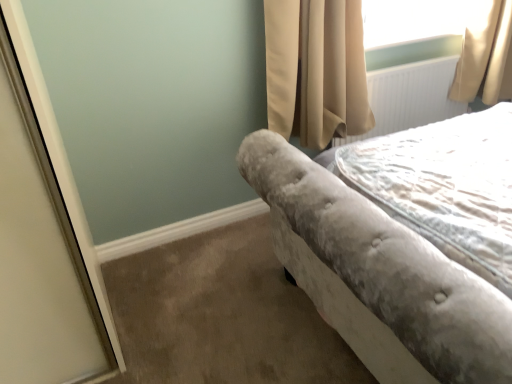
Question: Considering the positions of velvet gray bedspread at right and white textured radiator at upper right in the image, is velvet gray bedspread at right taller or shorter than white textured radiator at upper right?

Choices:
 (A) short
 (B) tall

Answer: (A)

Question: Is velvet gray bedspread at right inside the boundaries of white textured radiator at upper right, or outside?

Choices:
 (A) inside
 (B) outside

Answer: (B)

Question: Estimate the real-world distances between objects in this image. Which object is farther from the velvet gray bedspread at right?

Choices:
 (A) beige velvet curtain at upper right
 (B) white textured radiator at upper right
 (C) velvet gray bed at right

Answer: (B)

Question: Estimate the real-world distances between objects in this image. Which object is closer to the beige velvet curtain at upper right?

Choices:
 (A) velvet gray bed at right
 (B) white textured radiator at upper right
 (C) velvet gray bedspread at right

Answer: (B)